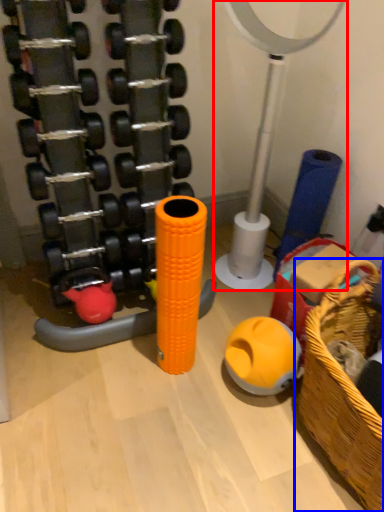
Question: Among these objects, which one is farthest to the camera, basketball hoop (highlighted by a red box) or basket (highlighted by a blue box)?

Choices:
 (A) basketball hoop
 (B) basket

Answer: (A)